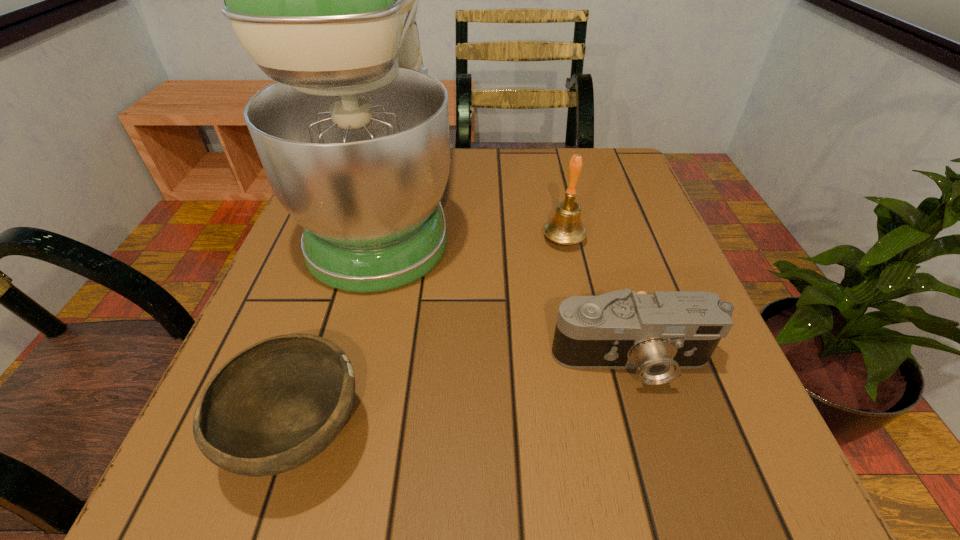
This screenshot has width=960, height=540. What are the coordinates of `free space that satisfies the following two spatial constraints: 1. on the controls of the second tallest object; 2. on the right side of the tallest object` in the screenshot? It's located at (379, 239).

What are the coordinates of `vacant space that satisfies the following two spatial constraints: 1. on the controls of the tallest object; 2. on the left side of the bell` in the screenshot? It's located at (379, 239).

Identify the location of free space that satisfies the following two spatial constraints: 1. on the controls of the tallest object; 2. on the front side of the bowl. (328, 434).

The width and height of the screenshot is (960, 540). I want to click on vacant space that satisfies the following two spatial constraints: 1. on the controls of the mixer; 2. on the front side of the bowl, so click(x=328, y=434).

I want to click on free space that satisfies the following two spatial constraints: 1. on the controls of the bell; 2. on the left side of the tallest object, so click(x=379, y=239).